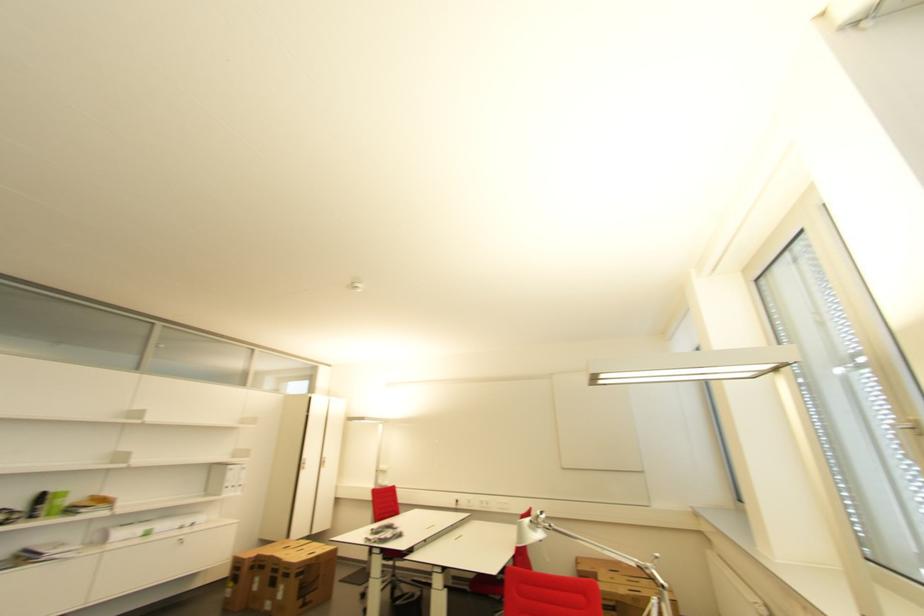
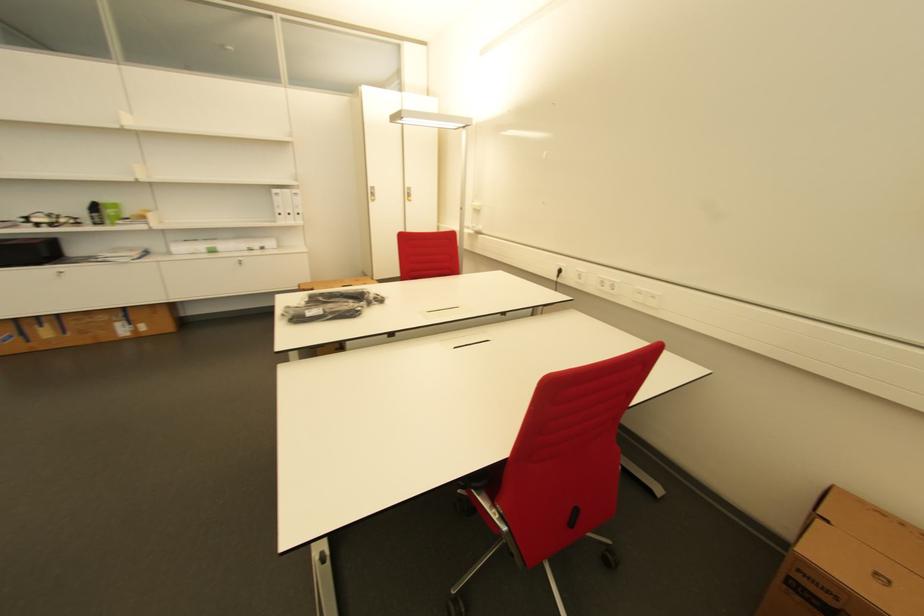
In the second image, find the point that corresponds to pixel 238 487 in the first image.

(294, 216)